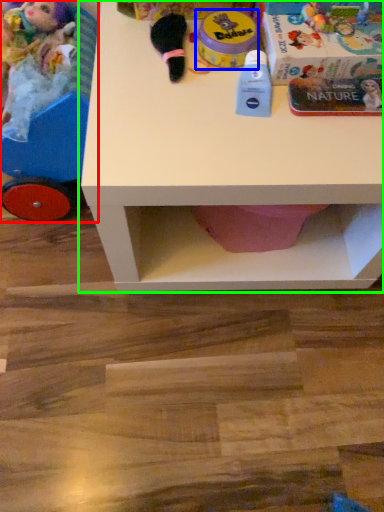
Question: Which object is positioned closest to toy (highlighted by a red box)? Select from toy (highlighted by a blue box) and table (highlighted by a green box).

Choices:
 (A) toy
 (B) table

Answer: (B)